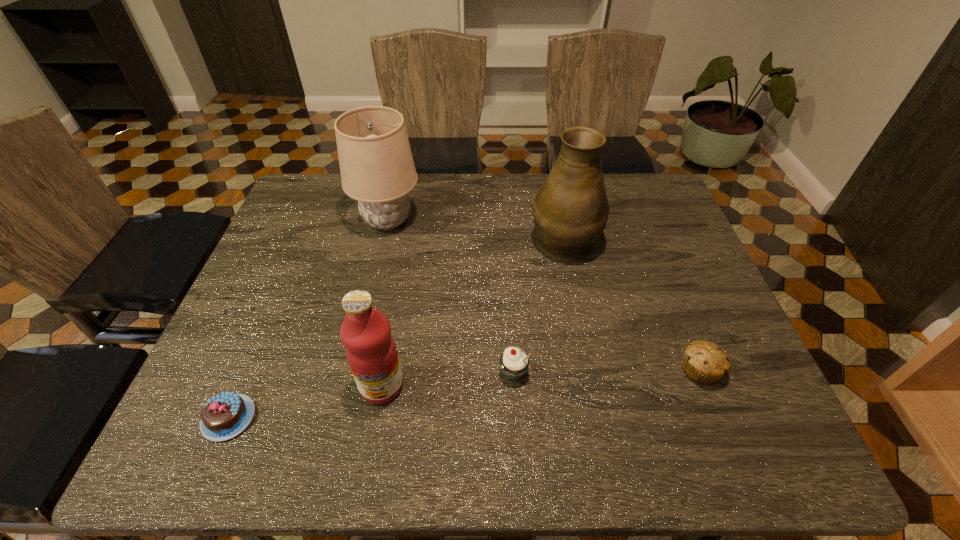
I want to click on unoccupied area between the fifth object from left to right and the shortest object, so click(x=396, y=328).

Identify the location of vacant region between the lampshade and the fruit juice. The height and width of the screenshot is (540, 960). (385, 303).

This screenshot has height=540, width=960. In order to click on unoccupied position between the cupcake and the muffin in this screenshot , I will do `click(607, 372)`.

Image resolution: width=960 pixels, height=540 pixels. What are the coordinates of `vacant space in between the pitcher and the lampshade` in the screenshot? It's located at (476, 230).

The height and width of the screenshot is (540, 960). Identify the location of free space between the lampshade and the fruit juice. tap(385, 303).

The image size is (960, 540). I want to click on free space between the lampshade and the fifth tallest object, so click(x=544, y=295).

Identify the location of unoccupied area between the chocolate cake and the second shortest object. This screenshot has width=960, height=540. (465, 394).

Locate an element on the screen. free space between the cupcake and the fifth object from left to right is located at coordinates (539, 306).

This screenshot has height=540, width=960. Identify the location of vacant area between the fruit juice and the cupcake. (447, 380).

Choose which object is the nearest neighbor to the fifth object from left to right. Please provide its 2D coordinates. Your answer should be formatted as a tuple, i.e. [(x, y)], where the tuple contains the x and y coordinates of a point satisfying the conditions above.

[(704, 362)]